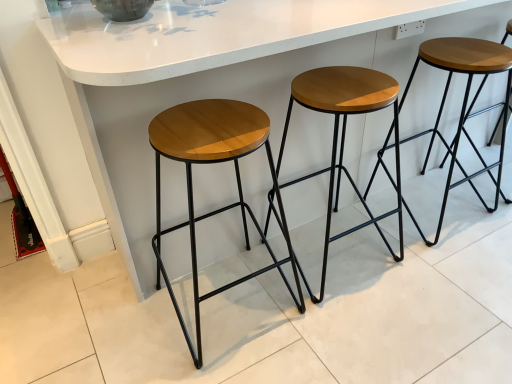
Identify the location of vacant area that lies to the right of wooden seat at center, arranged as the 1th stool when viewed from the right. This screenshot has width=512, height=384. (487, 192).